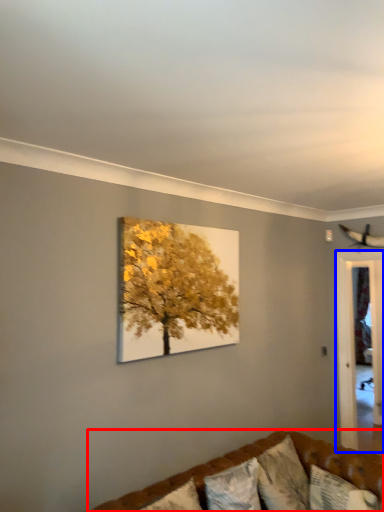
Question: Which object is further to the camera taking this photo, studio couch (highlighted by a red box) or glass door (highlighted by a blue box)?

Choices:
 (A) studio couch
 (B) glass door

Answer: (B)